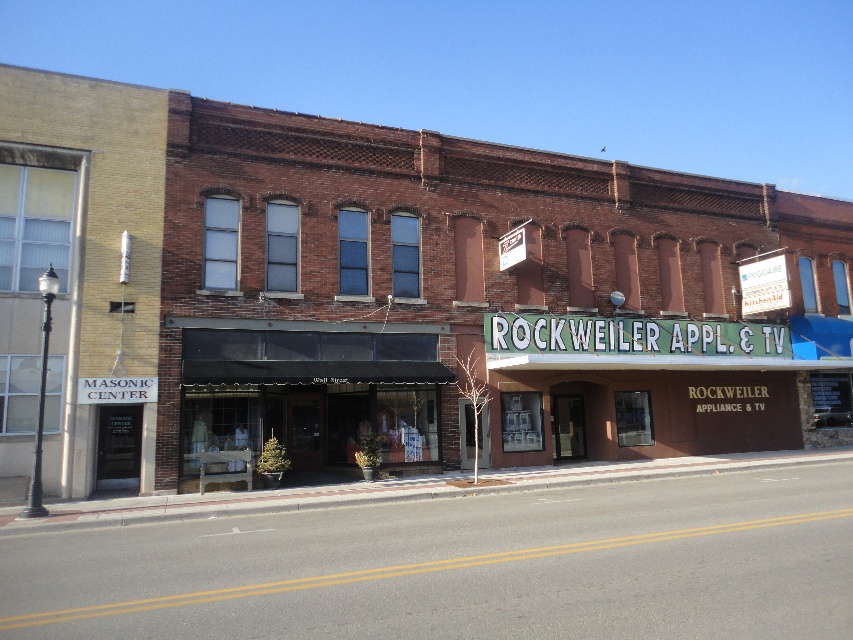
Between brown brick building at center and matte black awning at center, which one appears on the left side from the viewer's perspective?

From the viewer's perspective, matte black awning at center appears more on the left side.

Does brown brick building at center appear on the right side of matte black awning at center?

Yes, brown brick building at center is to the right of matte black awning at center.

This screenshot has width=853, height=640. What do you see at coordinates (405, 292) in the screenshot? I see `brown brick building at center` at bounding box center [405, 292].

This screenshot has width=853, height=640. I want to click on brown brick building at center, so click(405, 292).